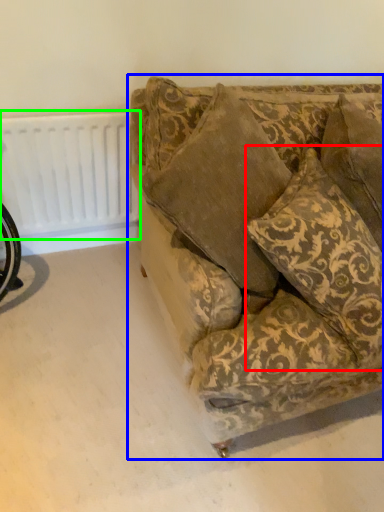
Question: Which object is the closest to the throw pillow (highlighted by a red box)? Choose among these: studio couch (highlighted by a blue box) or radiator (highlighted by a green box).

Choices:
 (A) studio couch
 (B) radiator

Answer: (A)